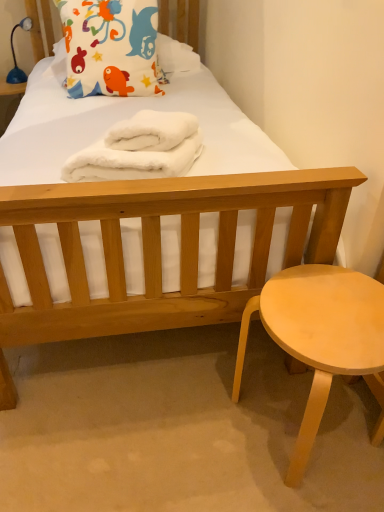
The image size is (384, 512). Describe the element at coordinates (15, 55) in the screenshot. I see `blue plastic lamp at upper left` at that location.

What do you see at coordinates (321, 338) in the screenshot? This screenshot has width=384, height=512. I see `light wood stool at lower right` at bounding box center [321, 338].

What do you see at coordinates (140, 149) in the screenshot? The image size is (384, 512). I see `white fluffy towels at center` at bounding box center [140, 149].

Locate an element on the screen. fluffy cotton pillow at upper left is located at coordinates (110, 47).

Is white fluffy towels at center looking in the opposite direction of fluffy cotton pillow at upper left?

Yes.

From a real-world perspective, between white fluffy towels at center and fluffy cotton pillow at upper left, who is vertically lower?

white fluffy towels at center is physically lower.

Considering the sizes of objects white fluffy towels at center and fluffy cotton pillow at upper left in the image provided, who is bigger, white fluffy towels at center or fluffy cotton pillow at upper left?

fluffy cotton pillow at upper left is bigger.

Are blue plastic lamp at upper left and white fluffy towels at center beside each other?

No, blue plastic lamp at upper left is not with white fluffy towels at center.

You are a GUI agent. You are given a task and a screenshot of the screen. Output one action in this format:
    pyautogui.click(x=<x>, y=<y>)
    Task: Click on the lamp below the white fluffy towels at center (from a real-world perspective)
    Image resolution: width=384 pixels, height=512 pixels.
    Given the screenshot: What is the action you would take?
    pyautogui.click(x=15, y=55)

From a real-world perspective, is blue plastic lamp at upper left physically located above or below white fluffy towels at center?

blue plastic lamp at upper left is situated lower than white fluffy towels at center in the real world.

Does point (23, 27) come behind point (143, 129)?

Yes, it is.

Is point (140, 79) behind point (373, 345)?

Yes, point (140, 79) is farther from viewer.

This screenshot has width=384, height=512. What are the coordinates of `stool lying in front of the fluffy cotton pillow at upper left` in the screenshot? It's located at (321, 338).

Is fluffy cotton pillow at upper left in contact with light wood stool at lower right?

No, fluffy cotton pillow at upper left is not beside light wood stool at lower right.

Is light wood stool at lower right at the back of fluffy cotton pillow at upper left?

No, fluffy cotton pillow at upper left is not facing away from light wood stool at lower right.

Between blue plastic lamp at upper left and light wood stool at lower right, which one is positioned behind?

blue plastic lamp at upper left is behind.

Based on the photo, does blue plastic lamp at upper left have a smaller size compared to light wood stool at lower right?

Correct, blue plastic lamp at upper left occupies less space than light wood stool at lower right.

Which object is positioned more to the left, blue plastic lamp at upper left or light wood stool at lower right?

From the viewer's perspective, blue plastic lamp at upper left appears more on the left side.

I want to click on stool that appears on the right of blue plastic lamp at upper left, so click(321, 338).

How many degrees apart are the facing directions of white fluffy towels at center and blue plastic lamp at upper left?

The angular difference between white fluffy towels at center and blue plastic lamp at upper left is 17.9 degrees.

From the image's perspective, is white fluffy towels at center located above or below blue plastic lamp at upper left?

From the image's perspective, white fluffy towels at center appears below blue plastic lamp at upper left.

Could you tell me if white fluffy towels at center is turned towards blue plastic lamp at upper left?

No, white fluffy towels at center is not facing towards blue plastic lamp at upper left.

In terms of width, does white fluffy towels at center look wider or thinner when compared to blue plastic lamp at upper left?

Considering their sizes, white fluffy towels at center looks broader than blue plastic lamp at upper left.

Which is nearer, [81,40] or [8,81]?

The point [81,40] is more forward.

Considering the relative sizes of fluffy cotton pillow at upper left and blue plastic lamp at upper left in the image provided, is fluffy cotton pillow at upper left wider than blue plastic lamp at upper left?

Correct, the width of fluffy cotton pillow at upper left exceeds that of blue plastic lamp at upper left.

Does fluffy cotton pillow at upper left have a lesser height compared to blue plastic lamp at upper left?

In fact, fluffy cotton pillow at upper left may be taller than blue plastic lamp at upper left.

From a real-world perspective, is fluffy cotton pillow at upper left physically above blue plastic lamp at upper left?

Indeed, from a real-world perspective, fluffy cotton pillow at upper left stands above blue plastic lamp at upper left.

Is light wood stool at lower right to the left of blue plastic lamp at upper left from the viewer's perspective?

In fact, light wood stool at lower right is to the right of blue plastic lamp at upper left.

How different are the orientations of light wood stool at lower right and blue plastic lamp at upper left in degrees?

light wood stool at lower right and blue plastic lamp at upper left are facing 39.5 degrees away from each other.

Can you confirm if light wood stool at lower right is shorter than blue plastic lamp at upper left?

No, light wood stool at lower right is not shorter than blue plastic lamp at upper left.

In the image, there is a fluffy cotton pillow at upper left. At what (x,y) coordinates should I click in order to perform the action: click on material below it (from the image's perspective). Please return your answer as a coordinate pair (x, y). Looking at the image, I should click on click(x=140, y=149).

In order to click on material above the blue plastic lamp at upper left (from a real-world perspective) in this screenshot , I will do [x=140, y=149].

In the scene shown: When comparing their distances from white fluffy towels at center, does fluffy cotton pillow at upper left or light wood stool at lower right seem further?

fluffy cotton pillow at upper left is further to white fluffy towels at center.

When comparing their distances from white fluffy towels at center, does light wood stool at lower right or blue plastic lamp at upper left seem closer?

The object closer to white fluffy towels at center is light wood stool at lower right.

Which object lies nearer to the anchor point blue plastic lamp at upper left, light wood stool at lower right or fluffy cotton pillow at upper left?

fluffy cotton pillow at upper left.

Considering their positions, is blue plastic lamp at upper left positioned further to fluffy cotton pillow at upper left than white fluffy towels at center?

Based on the image, blue plastic lamp at upper left appears to be further to fluffy cotton pillow at upper left.

Which object lies nearer to the anchor point fluffy cotton pillow at upper left, light wood stool at lower right or white fluffy towels at center?

Among the two, white fluffy towels at center is located nearer to fluffy cotton pillow at upper left.

Estimate the real-world distances between objects in this image. Which object is closer to blue plastic lamp at upper left, white fluffy towels at center or light wood stool at lower right?

white fluffy towels at center.

Estimate the real-world distances between objects in this image. Which object is closer to light wood stool at lower right, white fluffy towels at center or blue plastic lamp at upper left?

white fluffy towels at center.

From the image, which object appears to be farther from blue plastic lamp at upper left, light wood stool at lower right or white fluffy towels at center?

light wood stool at lower right lies further to blue plastic lamp at upper left than the other object.

Find the location of `pillow between blue plastic lamp at upper left and light wood stool at lower right in the vertical direction`. pillow between blue plastic lamp at upper left and light wood stool at lower right in the vertical direction is located at coordinates (110, 47).

Find the location of a particular element. This screenshot has width=384, height=512. pillow between white fluffy towels at center and blue plastic lamp at upper left from front to back is located at coordinates (110, 47).

You are a GUI agent. You are given a task and a screenshot of the screen. Output one action in this format:
    pyautogui.click(x=<x>, y=<y>)
    Task: Click on the material that lies between fluffy cotton pillow at upper left and light wood stool at lower right from top to bottom
    The height and width of the screenshot is (512, 384).
    Given the screenshot: What is the action you would take?
    pyautogui.click(x=140, y=149)

This screenshot has width=384, height=512. What are the coordinates of `material between light wood stool at lower right and blue plastic lamp at upper left in the front-back direction` in the screenshot? It's located at (140, 149).